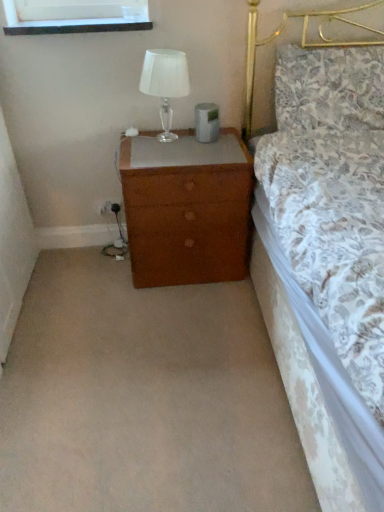
Where is `free space in front of clear glass table lamp at upper right`? free space in front of clear glass table lamp at upper right is located at coordinates (157, 149).